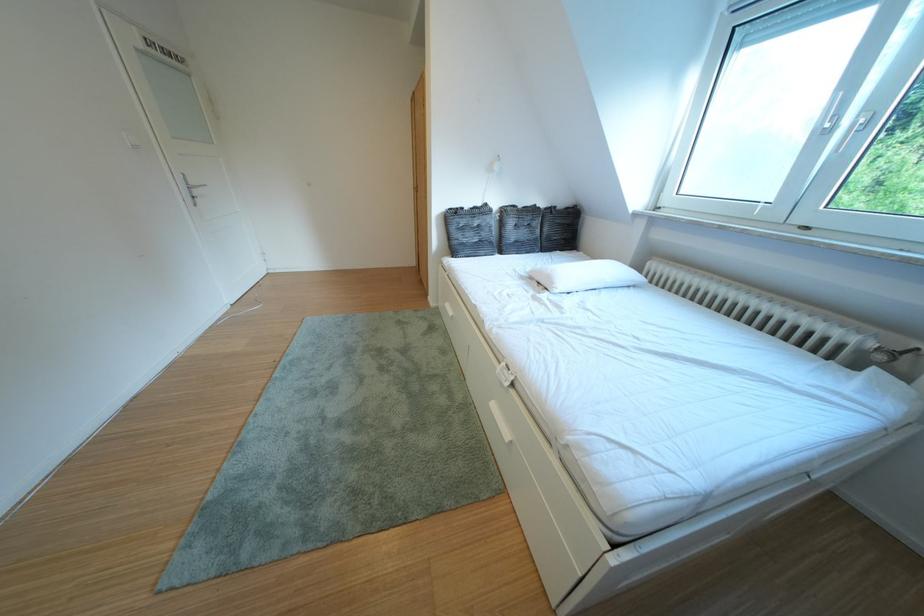
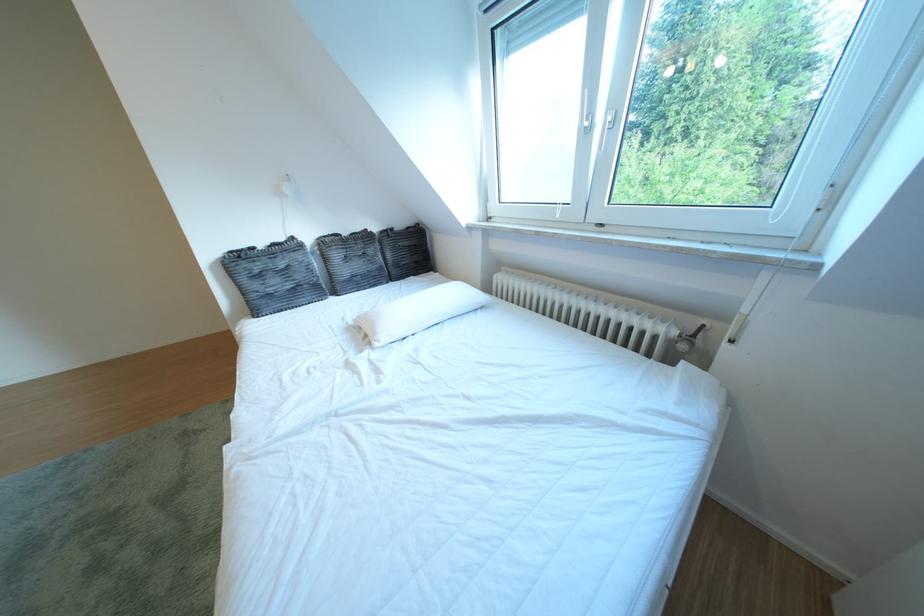
Question: Based on the continuous images, in which direction is the camera rotating? Reply with the corresponding letter.

Choices:
 (A) Left
 (B) Right
 (C) Up
 (D) Down

Answer: (B)